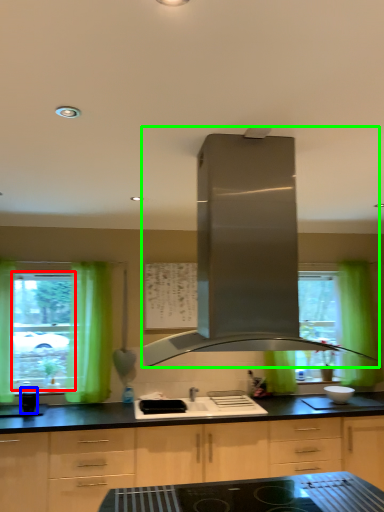
Question: Estimate the real-world distances between objects in this image. Which object is farther from window screen (highlighted by a red box), appliance (highlighted by a blue box) or home appliance (highlighted by a green box)?

Choices:
 (A) appliance
 (B) home appliance

Answer: (B)